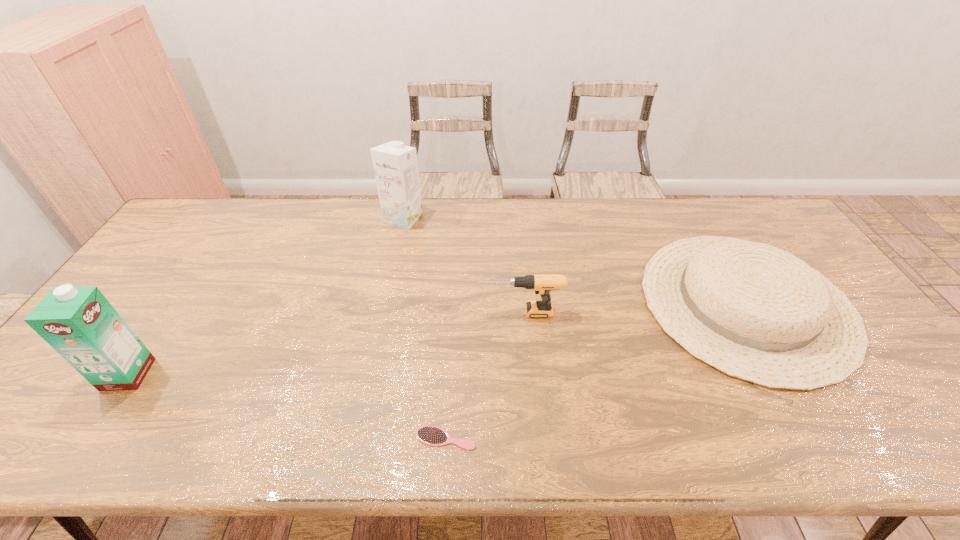
Where is `blank space located on the right of the right carton`? blank space located on the right of the right carton is located at coordinates (492, 218).

The image size is (960, 540). Find the location of `vacant space located 0.310m on the right of the left carton`. vacant space located 0.310m on the right of the left carton is located at coordinates (275, 374).

This screenshot has width=960, height=540. I want to click on vacant area located 0.370m on the handle side of the third shortest object, so click(x=345, y=312).

The width and height of the screenshot is (960, 540). I want to click on free point located on the handle side of the third shortest object, so click(x=388, y=312).

In order to click on blank space located on the handle side of the third shortest object in this screenshot , I will do `click(410, 312)`.

Where is `vacant area located 0.190m on the back of the fourth tallest object`? The height and width of the screenshot is (540, 960). vacant area located 0.190m on the back of the fourth tallest object is located at coordinates [x=688, y=206].

The image size is (960, 540). I want to click on vacant area located on the right of the third object from right to left, so click(x=605, y=438).

This screenshot has height=540, width=960. Identify the location of carton that is at the far edge. (395, 165).

At what (x,y) coordinates should I click in order to perform the action: click on sunhat that is at the far edge. Please return your answer as a coordinate pair (x, y). Image resolution: width=960 pixels, height=540 pixels. Looking at the image, I should click on (755, 312).

Locate an element on the screen. object present at the near edge is located at coordinates (430, 435).